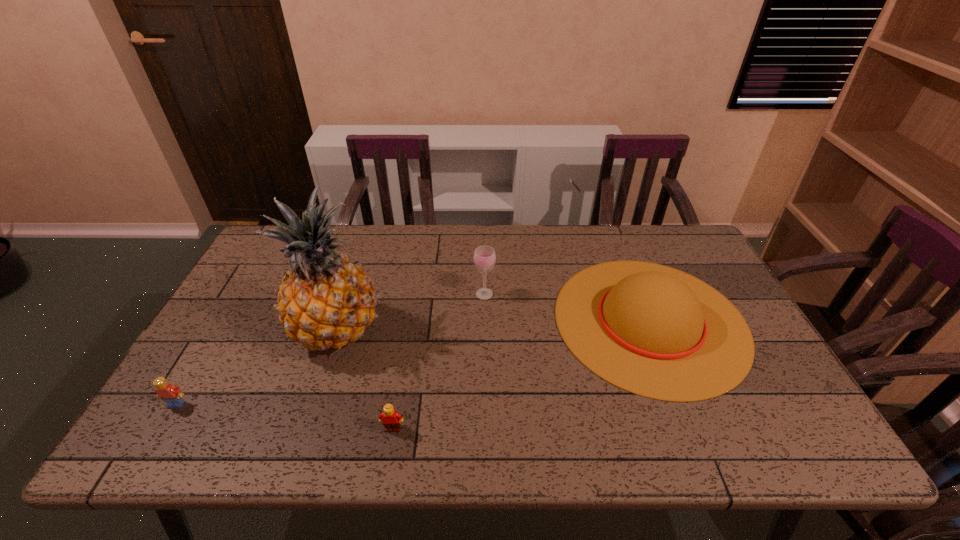
Where is `vacant area between the pineapple and the nearer Lego`? This screenshot has height=540, width=960. vacant area between the pineapple and the nearer Lego is located at coordinates (366, 380).

Identify the location of object that is the second closest to the pineapple. (172, 395).

Where is `object that is the closest one to the third object from right to left`? The width and height of the screenshot is (960, 540). object that is the closest one to the third object from right to left is located at coordinates (325, 301).

The width and height of the screenshot is (960, 540). Identify the location of free space that satisfies the following two spatial constraints: 1. on the back side of the tallest object; 2. on the left side of the wineglass. (350, 294).

Find the location of a particular element. Image resolution: width=960 pixels, height=540 pixels. vacant point that satisfies the following two spatial constraints: 1. on the back side of the wineglass; 2. on the left side of the tallest object is located at coordinates (350, 294).

You are a GUI agent. You are given a task and a screenshot of the screen. Output one action in this format:
    pyautogui.click(x=<x>, y=<y>)
    Task: Click on the vacant area that satisfies the following two spatial constraints: 1. on the back side of the tallest object; 2. on the left side of the sombrero
    This screenshot has height=540, width=960.
    Given the screenshot: What is the action you would take?
    pyautogui.click(x=342, y=320)